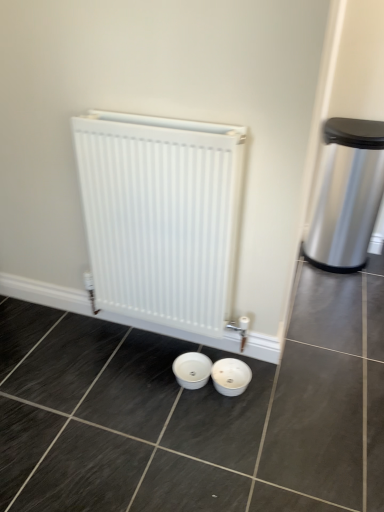
I want to click on vacant space underneath white matte radiator at center (from a real-world perspective), so click(163, 340).